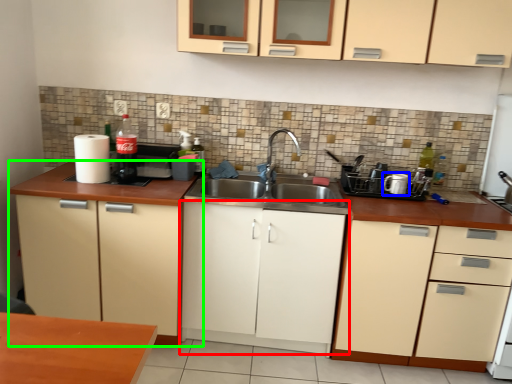
Question: Based on their relative distances, which object is nearer to cabinetry (highlighted by a red box)? Choose from appliance (highlighted by a blue box) and cabinetry (highlighted by a green box).

Choices:
 (A) appliance
 (B) cabinetry

Answer: (B)